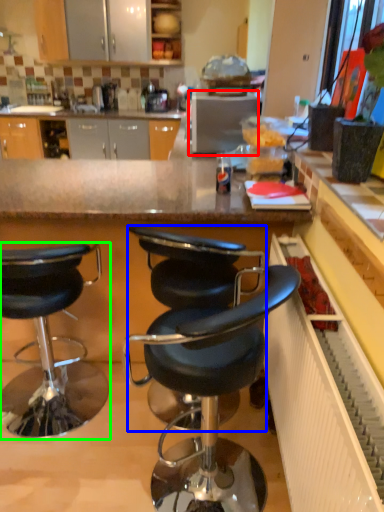
Question: Considering the real-world distances, which object is farthest from appliance (highlighted by a red box)? chair (highlighted by a blue box) or chair (highlighted by a green box)?

Choices:
 (A) chair
 (B) chair

Answer: (B)